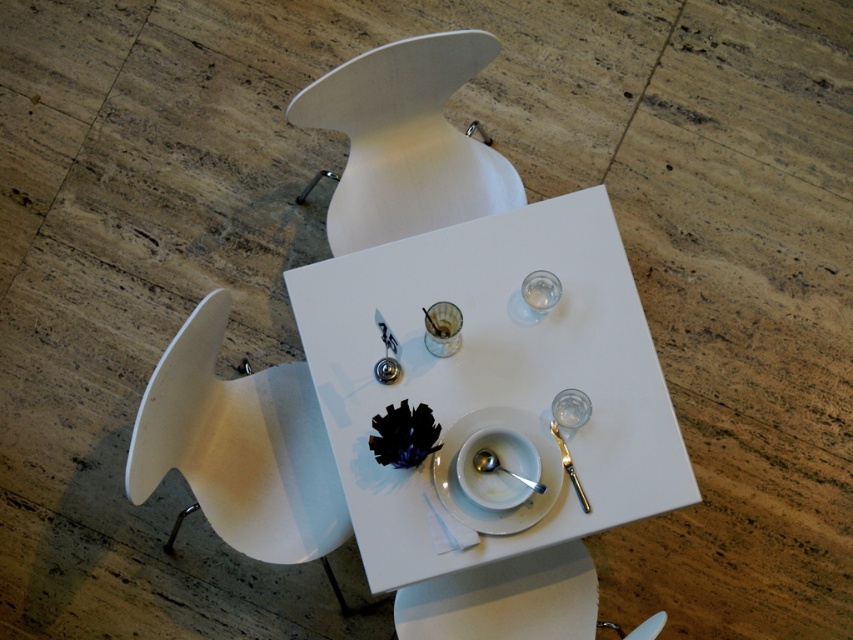
You are setting up a table for a dinner party and need to ensure that all items are placed correctly. Which item, the transparent glass wine glass at center or the shiny metallic spoon at center, should be placed in a higher position if you want to avoid it touching the tablecloth?

The transparent glass wine glass at center has a greater height compared to the shiny metallic spoon at center, so it should be placed in a higher position to avoid touching the tablecloth.

You are sitting at the dining table and want to pick up the shiny metallic spoon at center. Which direction should you move your hand to reach it from the white matte chair at upper center?

The white matte chair at upper center is above the shiny metallic spoon at center, so you should move your hand downward to reach the spoon.